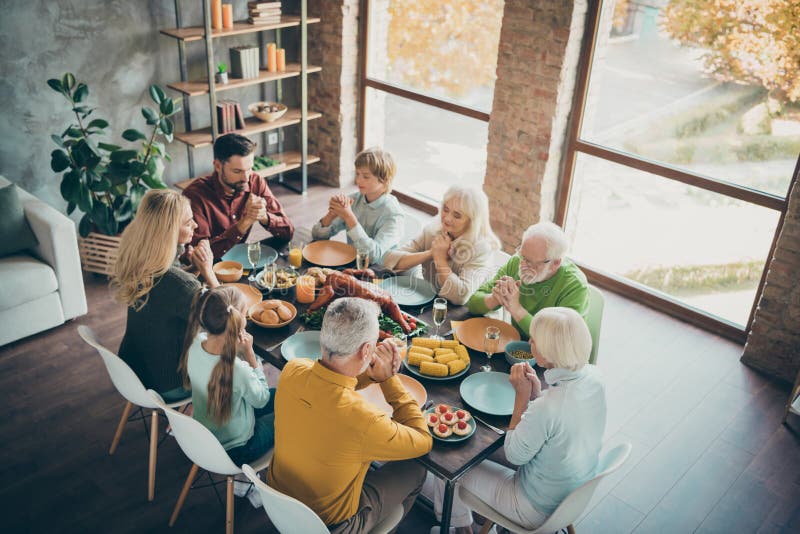
Where is `white back of chairs`? The image size is (800, 534). white back of chairs is located at coordinates (110, 381), (194, 439), (285, 506), (572, 498), (592, 313).